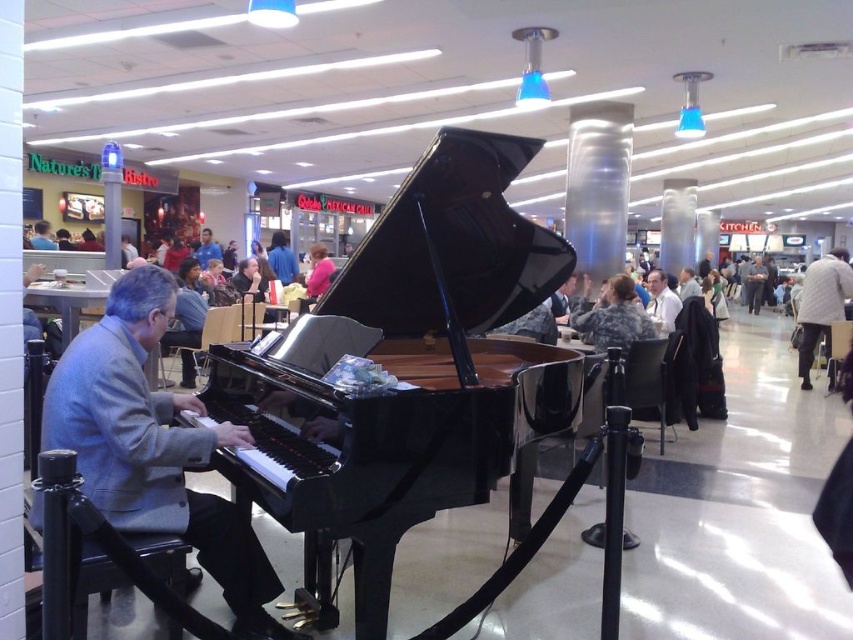
Question: Is black polished piano at center further to the viewer compared to gray woolen jacket at left?

Choices:
 (A) no
 (B) yes

Answer: (A)

Question: Observing the image, what is the correct spatial positioning of black polished piano at center in reference to gray woolen jacket at left?

Choices:
 (A) right
 (B) left

Answer: (A)

Question: Which of these objects is positioned farthest from the gray woolen jacket at left?

Choices:
 (A) black polished piano at center
 (B) pink fabric jacket at center

Answer: (B)

Question: Is black polished piano at center positioned in front of gray woolen jacket at left?

Choices:
 (A) yes
 (B) no

Answer: (A)

Question: Which object appears farthest from the camera in this image?

Choices:
 (A) black polished piano at center
 (B) pink fabric jacket at center

Answer: (B)

Question: Which point is farther from the camera taking this photo?

Choices:
 (A) (495, 161)
 (B) (236, 624)
 (C) (321, 273)

Answer: (C)